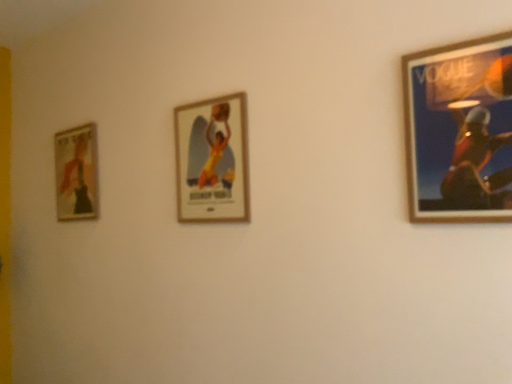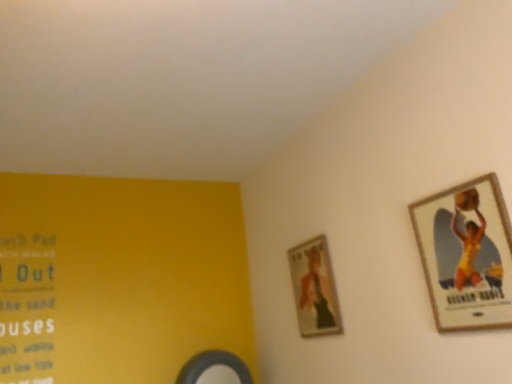
Question: Which way did the camera rotate in the video?

Choices:
 (A) rotated upward
 (B) rotated downward

Answer: (A)